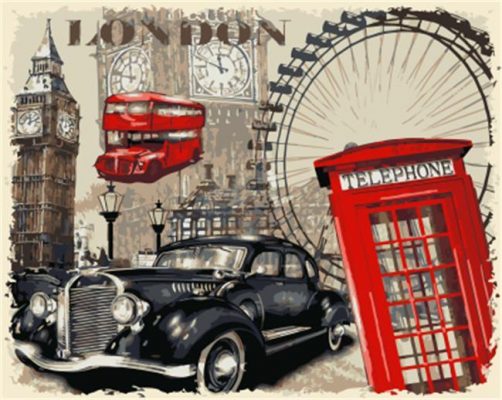
Where is `clock face`? This screenshot has height=400, width=502. clock face is located at coordinates (238, 76).